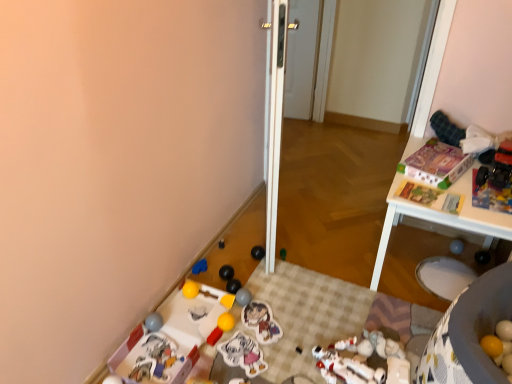
You are a GUI agent. You are given a task and a screenshot of the screen. Output one action in this format:
    pyautogui.click(x=<x>, y=<y>)
    Task: Click on the vacant space in front of matte cardboard box at upper right, marked as the 4th toy in a right-to-left arrangement
    
    Given the screenshot: What is the action you would take?
    pyautogui.click(x=472, y=198)